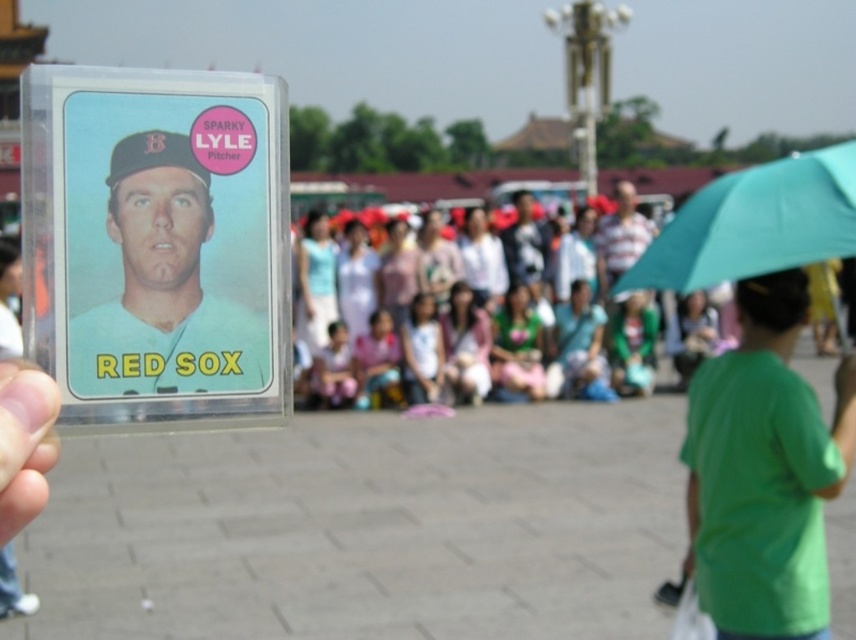
Question: Does matte plastic baseball card at center have a lesser width compared to clear plastic card at lower left?

Choices:
 (A) no
 (B) yes

Answer: (A)

Question: Is green matte shirt at lower right closer to camera compared to clear plastic card at lower left?

Choices:
 (A) no
 (B) yes

Answer: (A)

Question: Which of the following is the farthest from the observer?

Choices:
 (A) matte plastic baseball card at center
 (B) matte plastic crowd at center

Answer: (B)

Question: Is matte plastic baseball card at center further to camera compared to clear plastic card at lower left?

Choices:
 (A) no
 (B) yes

Answer: (B)

Question: Based on their relative distances, which object is nearer to the green matte shirt at lower right?

Choices:
 (A) green fabric umbrella at right
 (B) matte plastic crowd at center
 (C) clear plastic card at lower left

Answer: (A)

Question: Which point is closer to the camera taking this photo?

Choices:
 (A) (31, 502)
 (B) (685, 269)
 (C) (129, 394)
 (D) (813, 417)

Answer: (A)